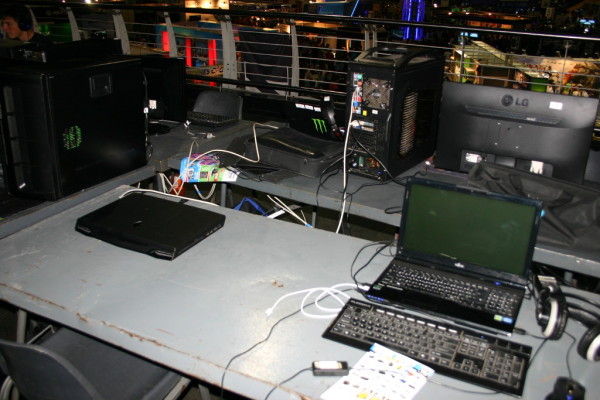
The height and width of the screenshot is (400, 600). Find the location of `chair`. chair is located at coordinates (95, 374).